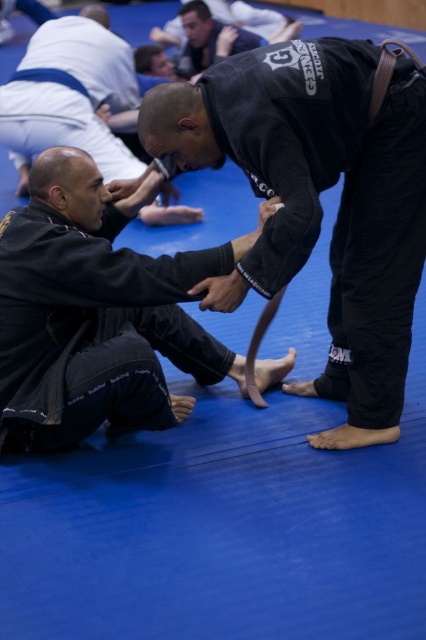
You are observing a Brazilian Jiu Jitsu training session and notice the black matte uniform at upper center. Where exactly is this uniform positioned in relation to the other elements in the scene?

The black matte uniform at upper center is located at point coordinates approximately 0.316 along the horizontal axis and 0.749 along the vertical axis within the image frame.

You are a BJJ instructor observing a training session. You notice two points marked on the mat where students are practicing. Which of the two points, point (x=184, y=125) or point (x=40, y=355), is closer to you as the instructor standing at the edge of the mat?

Point (x=184, y=125) is closer to the viewer than point (x=40, y=355), so the point closer to you as the instructor is point (x=184, y=125).